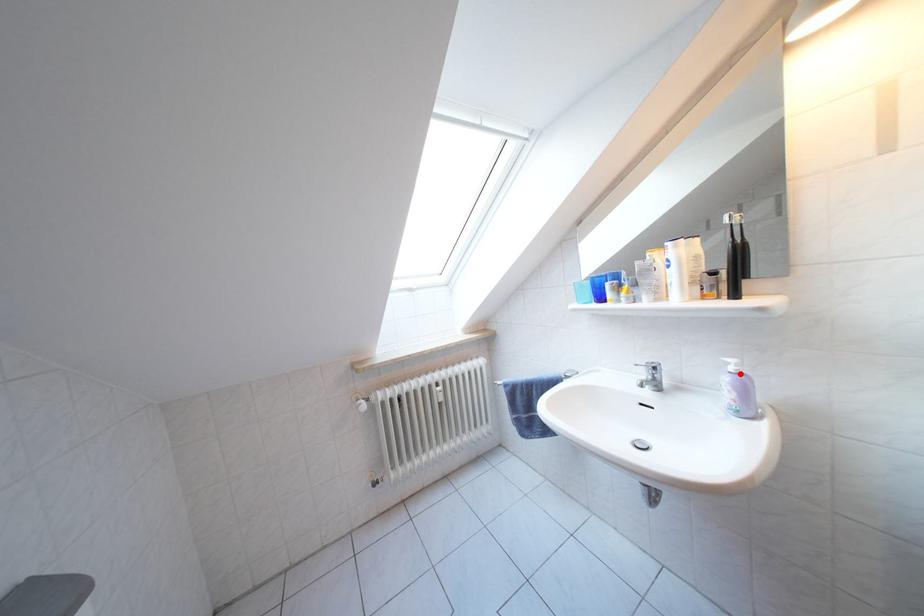
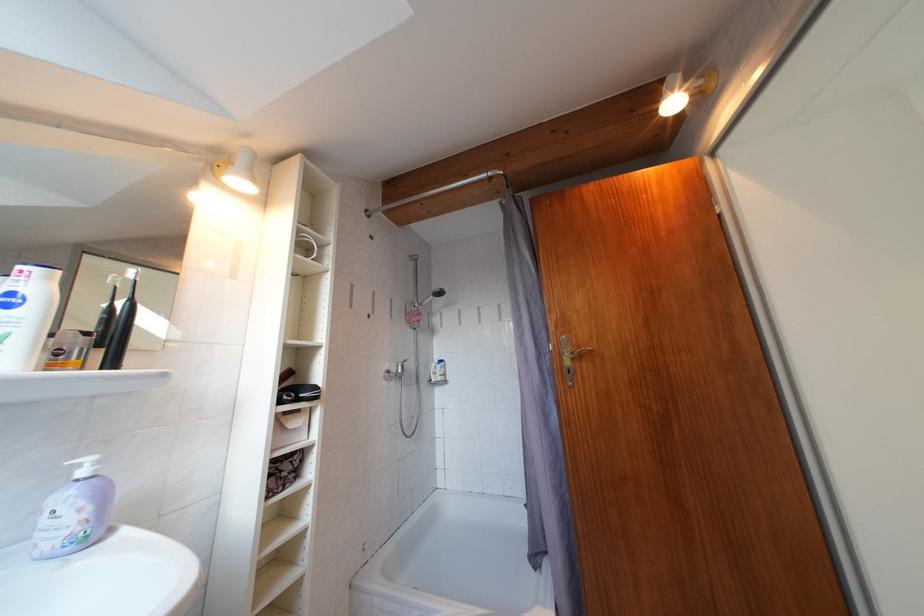
In the second image, find the point that corresponds to the highlighted location in the first image.

(92, 477)